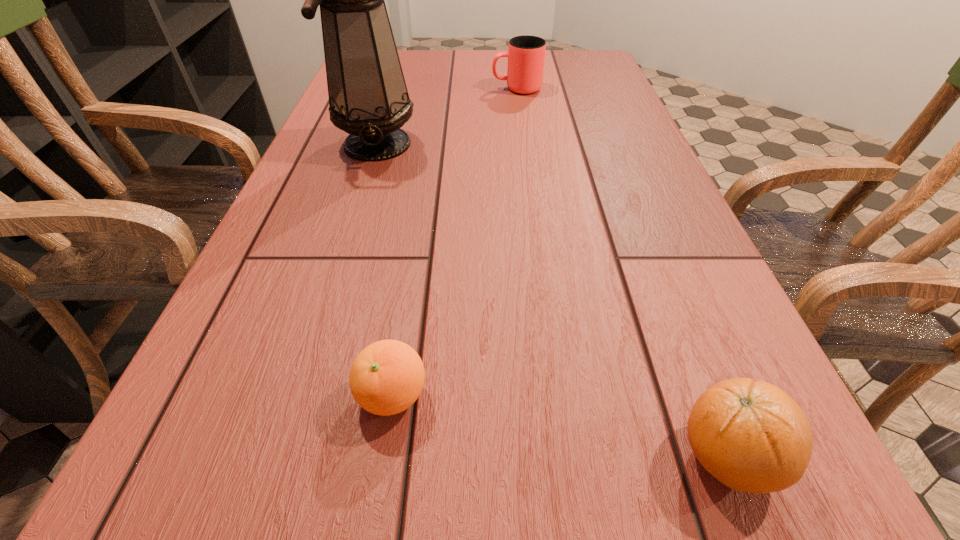
Where is `the tallest object`? Image resolution: width=960 pixels, height=540 pixels. the tallest object is located at coordinates (368, 98).

Locate an element on the screen. Image resolution: width=960 pixels, height=540 pixels. oil lamp is located at coordinates (368, 98).

The height and width of the screenshot is (540, 960). I want to click on the farthest object, so click(x=526, y=54).

What are the coordinates of `cup` in the screenshot? It's located at coord(526,54).

Locate an element on the screen. The width and height of the screenshot is (960, 540). the right orange is located at coordinates (750, 435).

Locate an element on the screen. Image resolution: width=960 pixels, height=540 pixels. the taller orange is located at coordinates (750, 435).

Where is `the left orange`? This screenshot has width=960, height=540. the left orange is located at coordinates (387, 377).

At what (x,y) coordinates should I click in order to perform the action: click on the shortest object. Please return your answer as a coordinate pair (x, y). Looking at the image, I should click on (387, 377).

The width and height of the screenshot is (960, 540). Find the location of `free space located on the front of the second farthest object`. free space located on the front of the second farthest object is located at coordinates (330, 294).

Locate an element on the screen. The height and width of the screenshot is (540, 960). free space located 0.300m on the handle side of the cup is located at coordinates (382, 89).